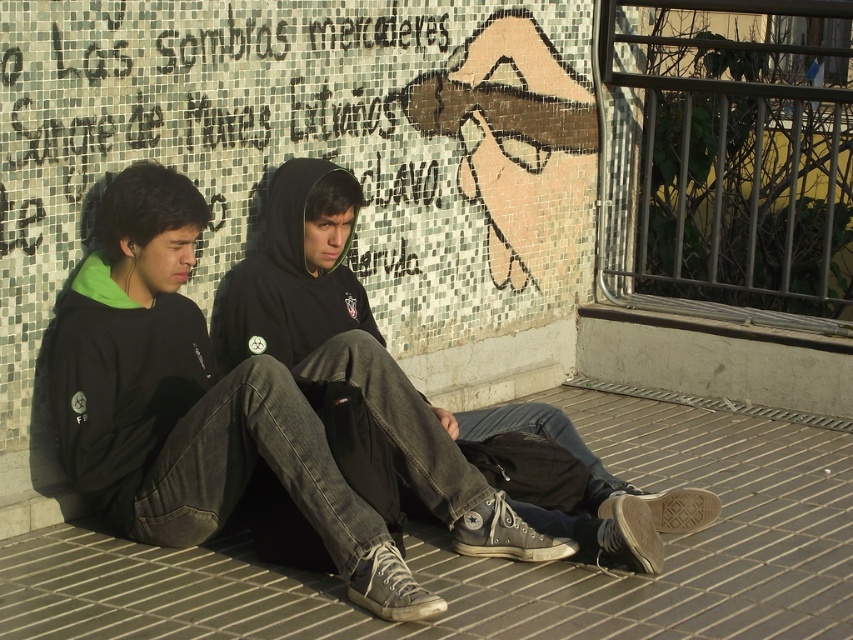
Question: Is gray brick pavement at lower center positioned at the back of black matte hoodie at center?

Choices:
 (A) yes
 (B) no

Answer: (B)

Question: Estimate the real-world distances between objects in this image. Which object is farther from the black matte hoodie at center?

Choices:
 (A) dark gray hoodie at center
 (B) gray brick pavement at lower center

Answer: (B)

Question: Does gray brick pavement at lower center appear on the left side of black matte hoodie at center?

Choices:
 (A) no
 (B) yes

Answer: (A)

Question: Does gray brick pavement at lower center have a smaller size compared to dark gray hoodie at center?

Choices:
 (A) yes
 (B) no

Answer: (B)

Question: Which point appears farthest from the camera in this image?

Choices:
 (A) (247, 369)
 (B) (329, 248)
 (C) (466, 579)

Answer: (B)

Question: Which object appears closest to the camera in this image?

Choices:
 (A) black matte hoodie at center
 (B) dark gray hoodie at center
 (C) gray brick pavement at lower center

Answer: (C)